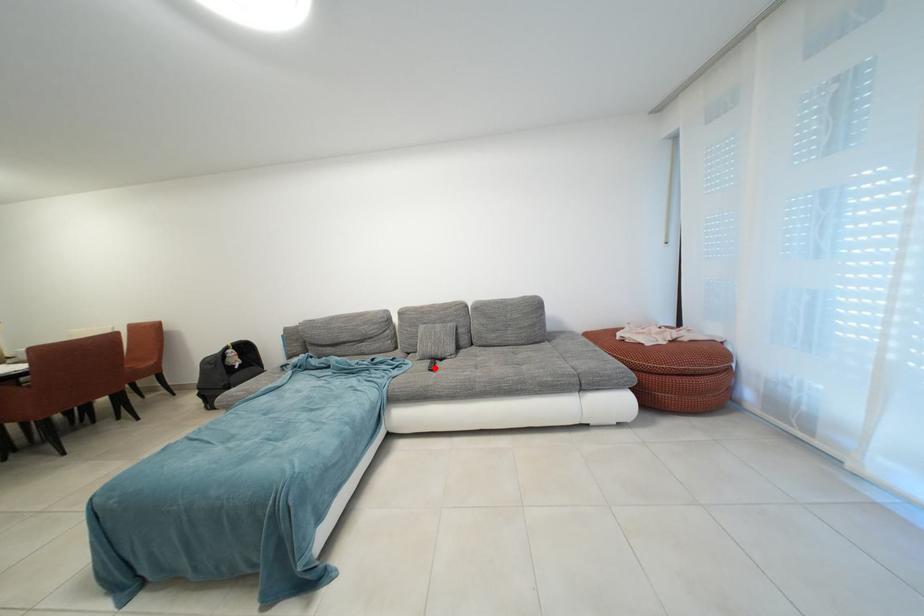
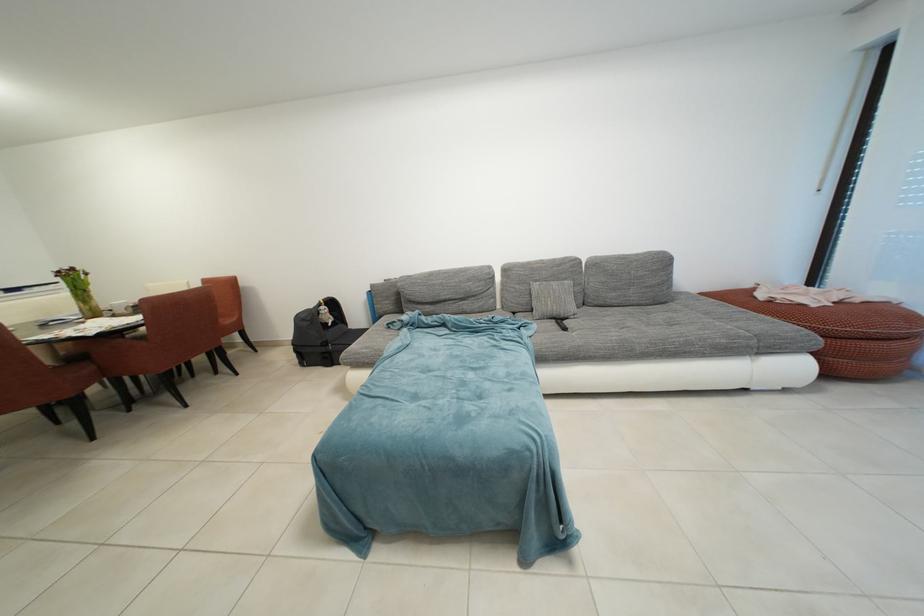
Locate, in the second image, the point that corresponds to the highlighted location in the first image.

(560, 328)